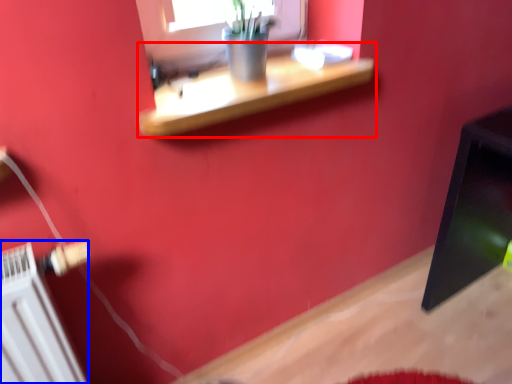
Question: Which object is closer to the camera taking this photo, shelf (highlighted by a red box) or radiator (highlighted by a blue box)?

Choices:
 (A) shelf
 (B) radiator

Answer: (B)